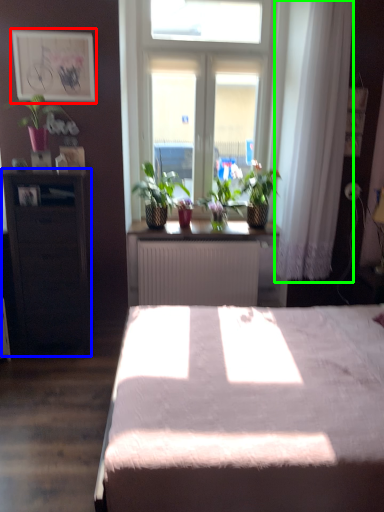
Question: Which object is the farthest from picture frame (highlighted by a red box)? Choose among these: table (highlighted by a blue box) or curtain (highlighted by a green box).

Choices:
 (A) table
 (B) curtain

Answer: (B)